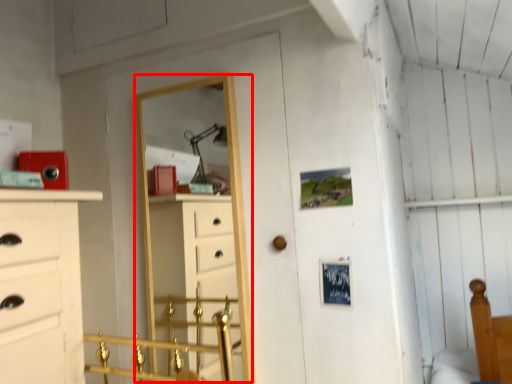
Question: From the image's perspective, where is mirror (annotated by the red box) located in relation to door handle in the image?

Choices:
 (A) above
 (B) below

Answer: (A)